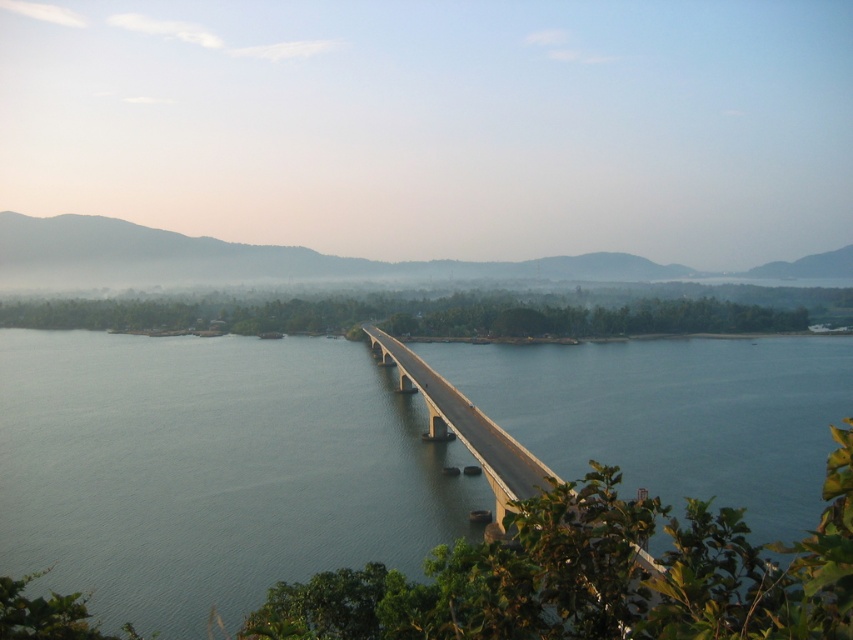
From the picture: Between clear blue water at center and concrete bridge at center, which one has more height?

concrete bridge at center is taller.

Is clear blue water at center above concrete bridge at center?

Indeed, clear blue water at center is positioned over concrete bridge at center.

What do you see at coordinates (206, 467) in the screenshot?
I see `clear blue water at center` at bounding box center [206, 467].

This screenshot has width=853, height=640. Identify the location of clear blue water at center. point(206,467).